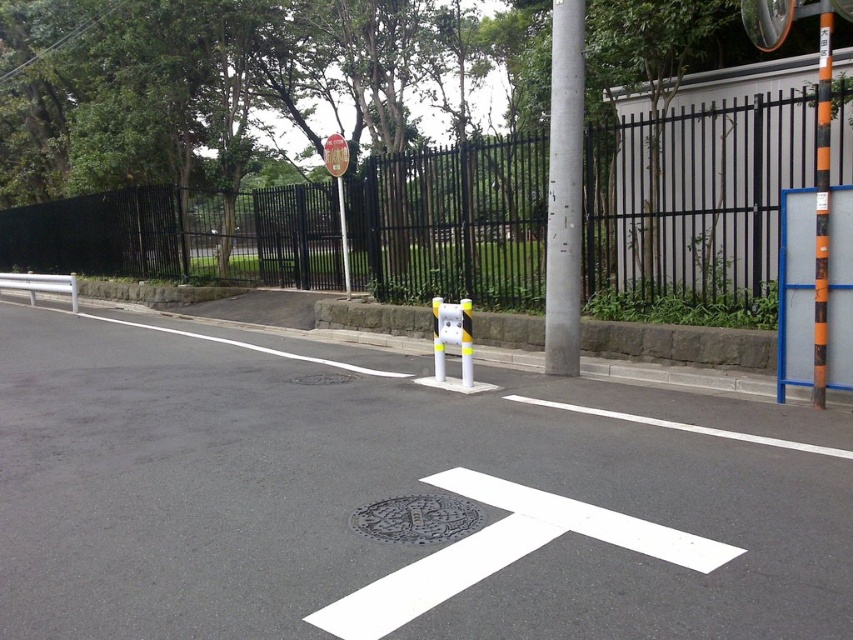
You are a delivery person trying to navigate through the street. You see the black metal fence at center and the metallic pole at center. Which object is positioned higher from the ground?

The black metal fence at center is located above the metallic pole at center, so the black metal fence at center is positioned higher from the ground.

You are a delivery driver approaching the crosswalk on the paved road. You notice the black metal fence at center and the silver metallic pole at upper center. Which object is positioned higher from the ground?

The black metal fence at center is located above the silver metallic pole at upper center, so it is positioned higher from the ground.

You are a pedestrian standing on the road and want to reach the park behind the black metal fence. You see the silver metallic pole at upper center and the metallic reflective sign at upper center. Which object is closer to you?

The silver metallic pole at upper center is closer to the viewer than the metallic reflective sign at upper center.